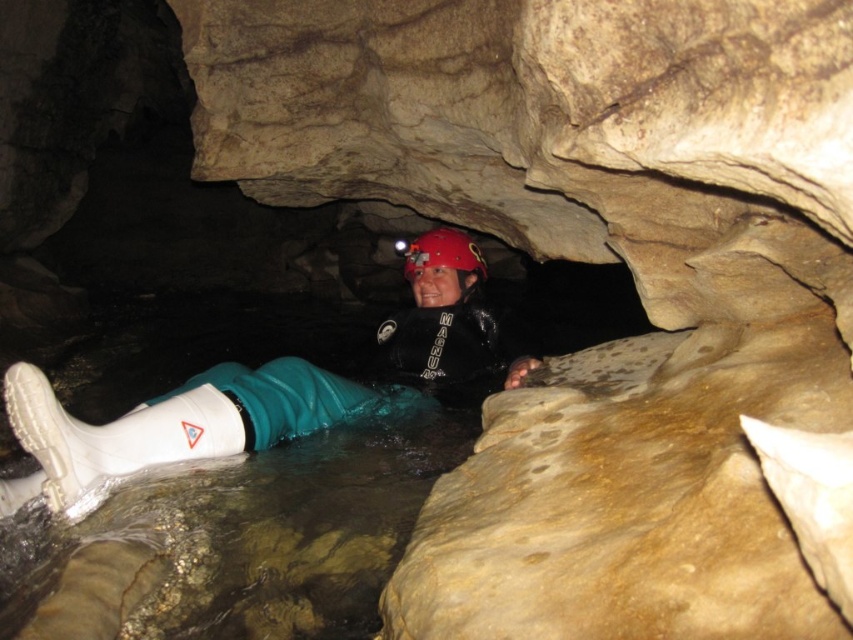
Question: Among these points, which one is nearest to the camera?

Choices:
 (A) (457, 243)
 (B) (180, 442)

Answer: (B)

Question: Does white rubber boot at lower left have a greater width compared to red matte helmet at center?

Choices:
 (A) yes
 (B) no

Answer: (A)

Question: Is white rubber boot at lower left below red matte helmet at center?

Choices:
 (A) yes
 (B) no

Answer: (A)

Question: Can you confirm if white rubber boot at lower left is positioned to the right of red matte helmet at center?

Choices:
 (A) no
 (B) yes

Answer: (A)